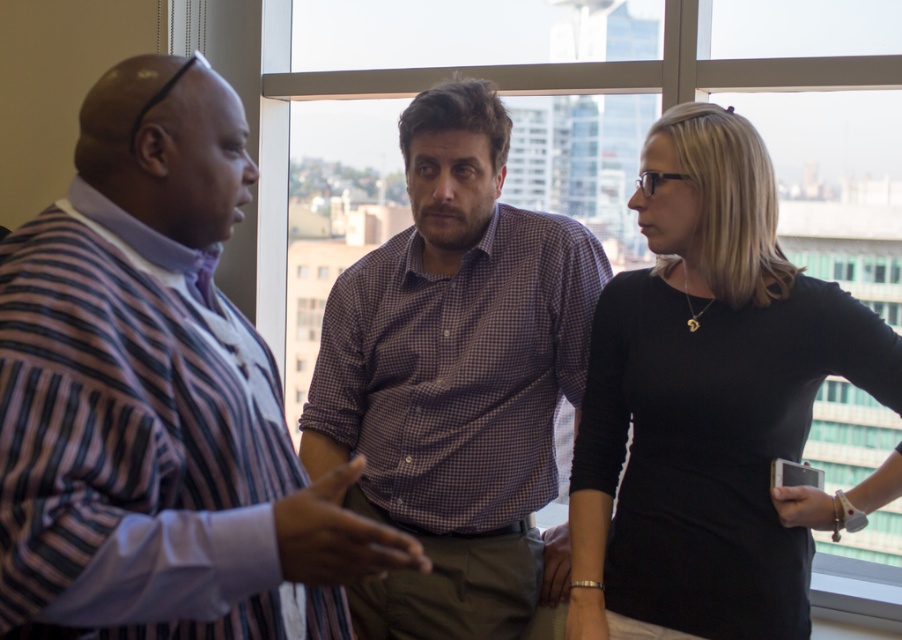
Is striped fabric shirt at center smaller than black matte dress at center?

No, striped fabric shirt at center is not smaller than black matte dress at center.

Does striped fabric shirt at center appear under black matte dress at center?

Incorrect, striped fabric shirt at center is not positioned below black matte dress at center.

At what (x,y) coordinates should I click in order to perform the action: click on striped fabric shirt at center. Please return your answer as a coordinate pair (x, y). The height and width of the screenshot is (640, 902). Looking at the image, I should click on (157, 397).

Is black matte dress at center wider than purple checkered shirt at center?

In fact, black matte dress at center might be narrower than purple checkered shirt at center.

Does black matte dress at center have a greater height compared to purple checkered shirt at center?

No, black matte dress at center is not taller than purple checkered shirt at center.

I want to click on black matte dress at center, so click(707, 397).

At what (x,y) coordinates should I click in order to perform the action: click on black matte dress at center. Please return your answer as a coordinate pair (x, y). Looking at the image, I should click on (707, 397).

Is the position of striped fabric shirt at center more distant than that of transparent glass window at center?

No.

Between striped fabric shirt at center and transparent glass window at center, which one has less height?

striped fabric shirt at center

In order to click on striped fabric shirt at center in this screenshot , I will do `click(157, 397)`.